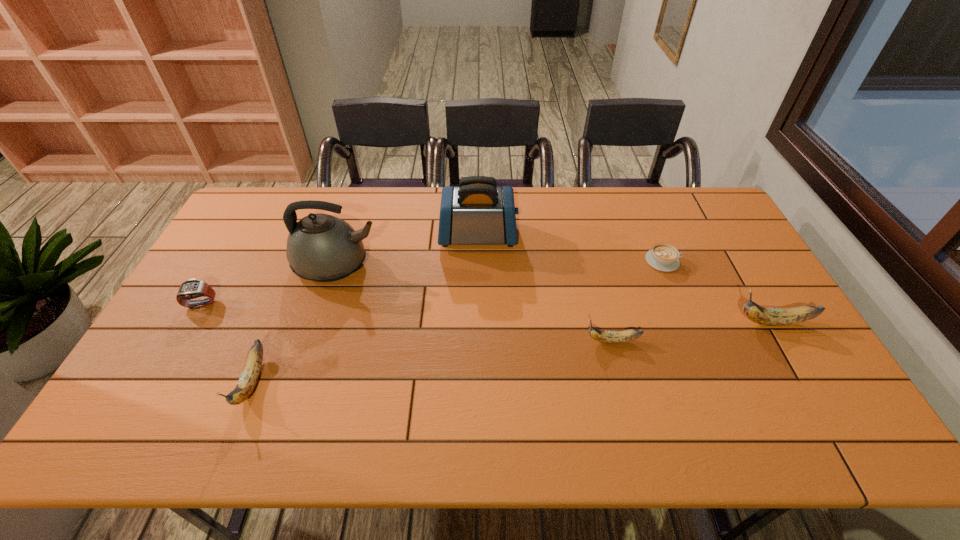
The width and height of the screenshot is (960, 540). Identify the location of the second tallest banana. tap(249, 377).

Locate an element on the screen. the nearest banana is located at coordinates (249, 377).

Locate an element on the screen. The image size is (960, 540). the shortest banana is located at coordinates [626, 335].

Where is `the second nearest banana`? This screenshot has height=540, width=960. the second nearest banana is located at coordinates (626, 335).

This screenshot has width=960, height=540. I want to click on the fifth farthest object, so click(x=765, y=316).

This screenshot has width=960, height=540. Find the location of `the tallest banana`. the tallest banana is located at coordinates (765, 316).

Where is `toaster`? This screenshot has height=540, width=960. toaster is located at coordinates (477, 212).

Find the location of a particular element. This screenshot has height=540, width=960. watch is located at coordinates (190, 289).

Locate an element on the screen. the fourth farthest object is located at coordinates (190, 289).

The height and width of the screenshot is (540, 960). Find the location of `the sixth object from left to right`. the sixth object from left to right is located at coordinates (663, 257).